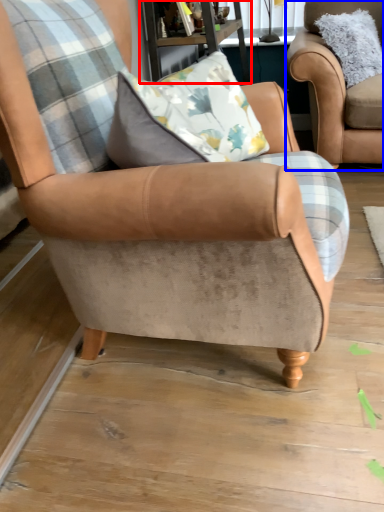
Question: Among these objects, which one is farthest to the camera, table (highlighted by a red box) or chair (highlighted by a blue box)?

Choices:
 (A) table
 (B) chair

Answer: (B)